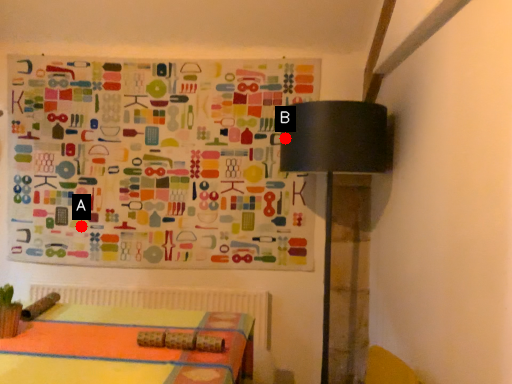
Question: Two points are circled on the image, labeled by A and B beside each circle. Which point is farther to the camera?

Choices:
 (A) A is further
 (B) B is further

Answer: (A)